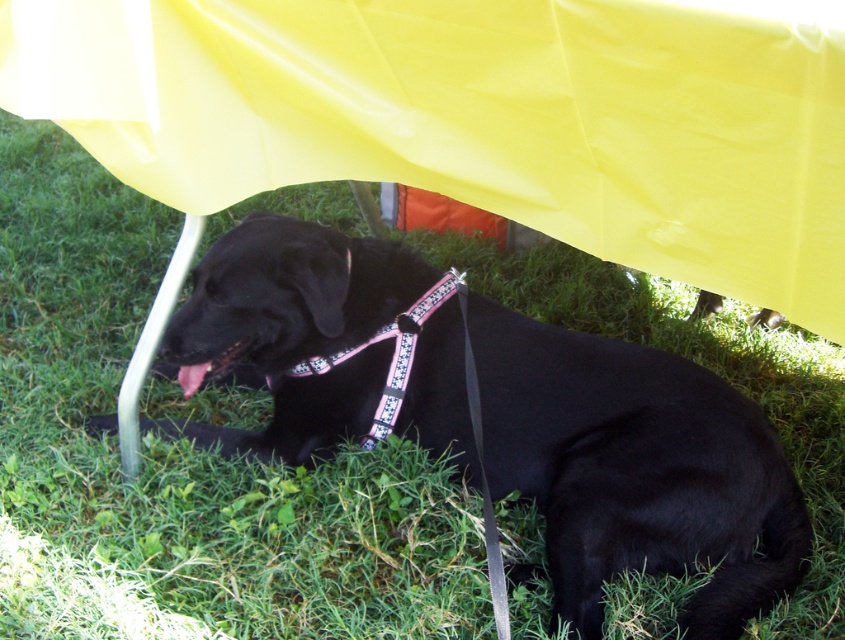
You are a dog owner who wants to ensure your black fabric dog at center is safe while under the yellow canopy. Since the pink fabric neckband at center is part of the harness, can you tell me if the dog might be able to move freely without the neckband getting tangled with the metal chair leg?

The black fabric dog at center is in front of the pink fabric neckband at center, so the neckband is closer to the metal chair leg. This means there is a higher chance of the pink fabric neckband at center getting tangled with the metal chair leg, so the dog might not move freely without supervision.

You are a dog owner who wants to ensure the pink fabric neckband at center is not too tight for the black fabric dog at center. Based on the scene, can you determine if the neckband is appropriately sized?

The black fabric dog at center might be wider than pink fabric neckband at center, so the neckband may be too small and not appropriately sized for the dog.